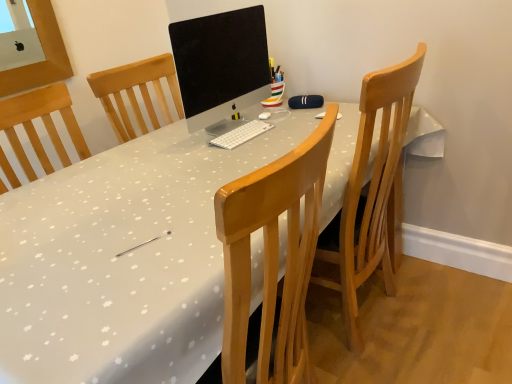
Locate an element on the screen. Image resolution: width=512 pixels, height=384 pixels. vacant region in front of matte black monitor at center is located at coordinates (212, 163).